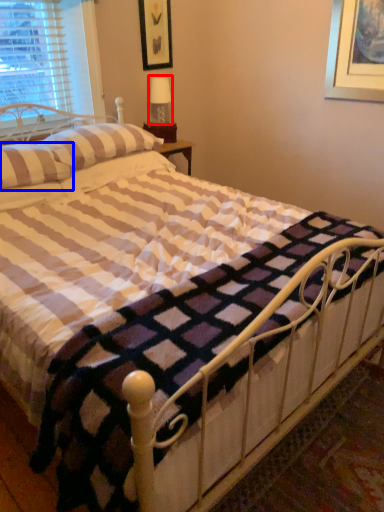
Question: Which object is further to the camera taking this photo, table lamp (highlighted by a red box) or pillow (highlighted by a blue box)?

Choices:
 (A) table lamp
 (B) pillow

Answer: (A)